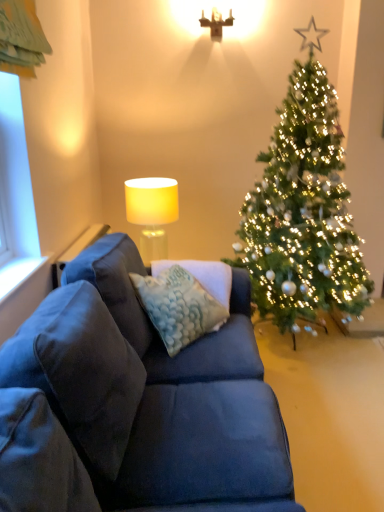
Question: Does white painted wood at left have a lesser width compared to white fabric lampshade at upper center?

Choices:
 (A) no
 (B) yes

Answer: (B)

Question: Can you confirm if white painted wood at left is positioned to the left of white fabric lampshade at upper center?

Choices:
 (A) yes
 (B) no

Answer: (A)

Question: Could you tell me if white painted wood at left is facing white fabric lampshade at upper center?

Choices:
 (A) yes
 (B) no

Answer: (B)

Question: Is white painted wood at left located outside white fabric lampshade at upper center?

Choices:
 (A) yes
 (B) no

Answer: (A)

Question: From a real-world perspective, does white painted wood at left stand above white fabric lampshade at upper center?

Choices:
 (A) yes
 (B) no

Answer: (A)

Question: Is white painted wood at left inside or outside of textured blue pillow at center?

Choices:
 (A) inside
 (B) outside

Answer: (B)

Question: Is white painted wood at left taller or shorter than textured blue pillow at center?

Choices:
 (A) short
 (B) tall

Answer: (A)

Question: Looking at their shapes, would you say white painted wood at left is wider or thinner than textured blue pillow at center?

Choices:
 (A) thin
 (B) wide

Answer: (A)

Question: From the image's perspective, is white painted wood at left above or below textured blue pillow at center?

Choices:
 (A) above
 (B) below

Answer: (A)

Question: Is matte white lampshade at upper center bigger or smaller than white painted wood at left?

Choices:
 (A) big
 (B) small

Answer: (A)

Question: Is point (221, 18) positioned closer to the camera than point (6, 295)?

Choices:
 (A) farther
 (B) closer

Answer: (A)

Question: Visually, is matte white lampshade at upper center positioned to the left or to the right of white painted wood at left?

Choices:
 (A) right
 (B) left

Answer: (A)

Question: Is matte white lampshade at upper center inside or outside of white painted wood at left?

Choices:
 (A) inside
 (B) outside

Answer: (B)

Question: Considering the positions of point (357, 309) and point (160, 330), is point (357, 309) closer or farther from the camera than point (160, 330)?

Choices:
 (A) closer
 (B) farther

Answer: (B)

Question: Is green textured christmas tree at right taller or shorter than textured blue pillow at center?

Choices:
 (A) short
 (B) tall

Answer: (B)